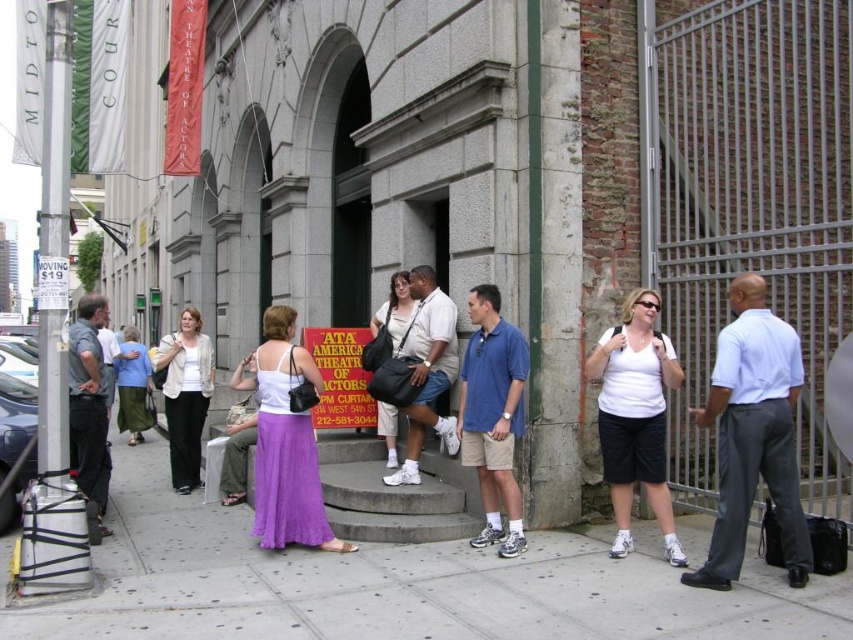
Question: Which object is farther from the camera taking this photo?

Choices:
 (A) blue cotton polo shirt at center
 (B) matte white shirt at center
 (C) white shirt at right
 (D) purple fabric skirt at center

Answer: (B)

Question: Is matte white shirt at center closer to the viewer compared to yellow paper sign at center?

Choices:
 (A) no
 (B) yes

Answer: (B)

Question: Is blue cotton polo shirt at center further to the viewer compared to matte white shirt at center?

Choices:
 (A) yes
 (B) no

Answer: (B)

Question: Does purple fabric skirt at center lie behind dark gray pants at left?

Choices:
 (A) no
 (B) yes

Answer: (B)

Question: Which point is farther to the camera?

Choices:
 (A) (602, 428)
 (B) (163, 388)

Answer: (B)

Question: Which object appears farthest from the camera in this image?

Choices:
 (A) matte white shirt at center
 (B) white matte tank top at center

Answer: (A)